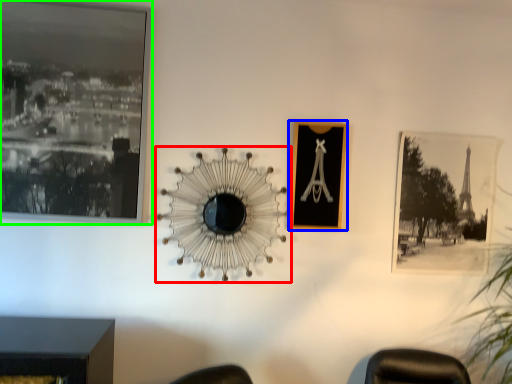
Question: Based on their relative distances, which object is nearer to mirror (highlighted by a red box)? Choose from picture frame (highlighted by a blue box) and picture frame (highlighted by a green box).

Choices:
 (A) picture frame
 (B) picture frame

Answer: (A)